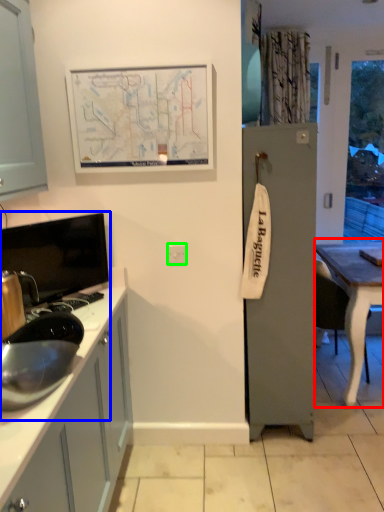
Question: Considering the real-world distances, which object is farthest from table (highlighted by a red box)? sink (highlighted by a blue box) or electric outlet (highlighted by a green box)?

Choices:
 (A) sink
 (B) electric outlet

Answer: (A)